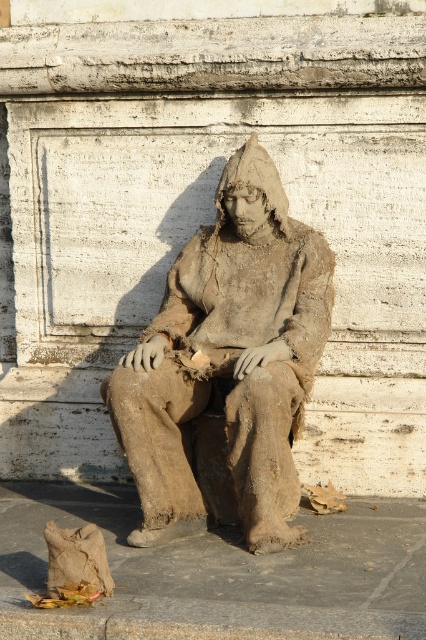
Question: Can you confirm if brown textured statue at center is bigger than brown fabric bag at lower left?

Choices:
 (A) no
 (B) yes

Answer: (B)

Question: Which point is closer to the camera taking this photo?

Choices:
 (A) (271, 444)
 (B) (379, 508)

Answer: (A)

Question: Is brown textured statue at center thinner than brown fabric bag at lower left?

Choices:
 (A) yes
 (B) no

Answer: (A)

Question: Which point appears farthest from the camera in this image?

Choices:
 (A) (236, 570)
 (B) (238, 196)

Answer: (B)

Question: Can you confirm if brown textured statue at center is positioned to the right of brown fabric bag at lower left?

Choices:
 (A) no
 (B) yes

Answer: (A)